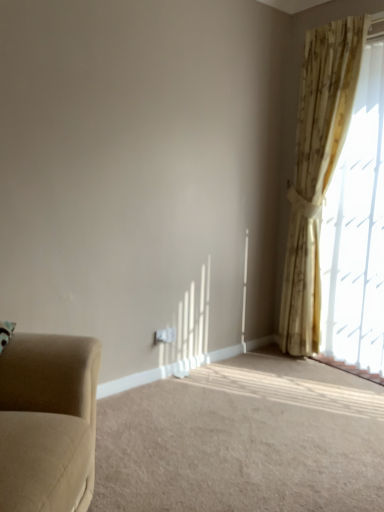
Question: Does suede-like beige armchair at lower left have a greater width compared to beige floral curtain at upper right?

Choices:
 (A) no
 (B) yes

Answer: (B)

Question: Is suede-like beige armchair at lower left not close to beige floral curtain at upper right?

Choices:
 (A) yes
 (B) no

Answer: (A)

Question: Does suede-like beige armchair at lower left appear on the left side of beige floral curtain at upper right?

Choices:
 (A) yes
 (B) no

Answer: (A)

Question: Can you confirm if suede-like beige armchair at lower left is shorter than beige floral curtain at upper right?

Choices:
 (A) no
 (B) yes

Answer: (B)

Question: Considering the relative sizes of suede-like beige armchair at lower left and beige floral curtain at upper right in the image provided, is suede-like beige armchair at lower left taller than beige floral curtain at upper right?

Choices:
 (A) yes
 (B) no

Answer: (B)

Question: Is suede-like beige armchair at lower left facing away from beige floral curtain at upper right?

Choices:
 (A) yes
 (B) no

Answer: (B)

Question: From the image's perspective, does beige fabric studio couch at left appear lower than beige floral curtain at upper right?

Choices:
 (A) no
 (B) yes

Answer: (B)

Question: Is beige fabric studio couch at left positioned with its back to beige floral curtain at upper right?

Choices:
 (A) yes
 (B) no

Answer: (B)

Question: Is beige fabric studio couch at left shorter than beige floral curtain at upper right?

Choices:
 (A) no
 (B) yes

Answer: (B)

Question: Is beige floral curtain at upper right surrounded by beige fabric studio couch at left?

Choices:
 (A) yes
 (B) no

Answer: (B)

Question: Does beige fabric studio couch at left come behind beige floral curtain at upper right?

Choices:
 (A) yes
 (B) no

Answer: (B)

Question: Is beige fabric studio couch at left aimed at beige floral curtain at upper right?

Choices:
 (A) yes
 (B) no

Answer: (B)

Question: Is suede-like beige armchair at lower left shorter than beige fabric studio couch at left?

Choices:
 (A) yes
 (B) no

Answer: (A)